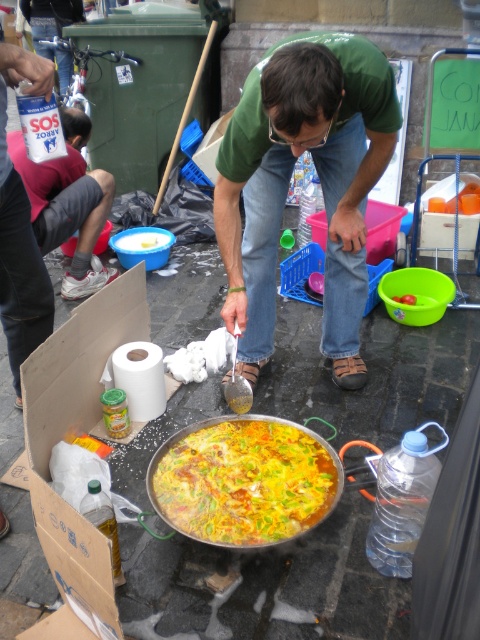
Who is lower down, matte green shirt at center or white paper towel at lower center?

white paper towel at lower center is below.

Does matte green shirt at center have a lesser height compared to white paper towel at lower center?

No.

This screenshot has height=640, width=480. I want to click on matte green shirt at center, so click(x=68, y=204).

The image size is (480, 640). Identify the location of matte green shirt at center. (68, 204).

Can you confirm if green matte shirt at center is bigger than matte green shirt at center?

Indeed, green matte shirt at center has a larger size compared to matte green shirt at center.

Is green matte shirt at center above matte green shirt at center?

Incorrect, green matte shirt at center is not positioned above matte green shirt at center.

Is point (223, 145) in front of point (12, 140)?

Yes, it is in front of point (12, 140).

Where is `green matte shirt at center`? green matte shirt at center is located at coordinates (289, 177).

Is green matte shirt at center positioned before white paper towel at lower center?

Yes, green matte shirt at center is closer to the viewer.

Who is positioned more to the left, green matte shirt at center or white paper towel at lower center?

white paper towel at lower center is more to the left.

Is point (257, 272) positioned behind point (156, 403)?

Yes.

The height and width of the screenshot is (640, 480). I want to click on green matte shirt at center, so [289, 177].